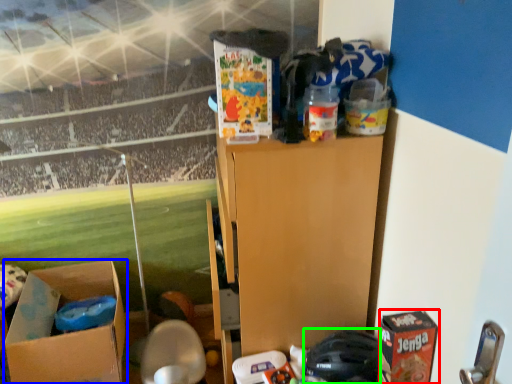
Question: Estimate the real-world distances between objects in this image. Which object is closer to cardboard box (highlighted by a red box), box (highlighted by a blue box) or toy (highlighted by a green box)?

Choices:
 (A) box
 (B) toy

Answer: (B)